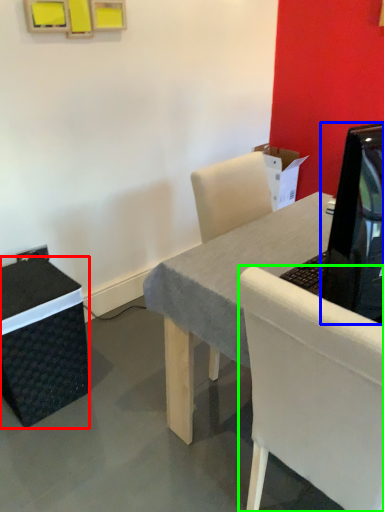
Question: Which object is the closest to the box (highlighted by a red box)? Choose among these: television (highlighted by a blue box) or chair (highlighted by a green box).

Choices:
 (A) television
 (B) chair

Answer: (B)